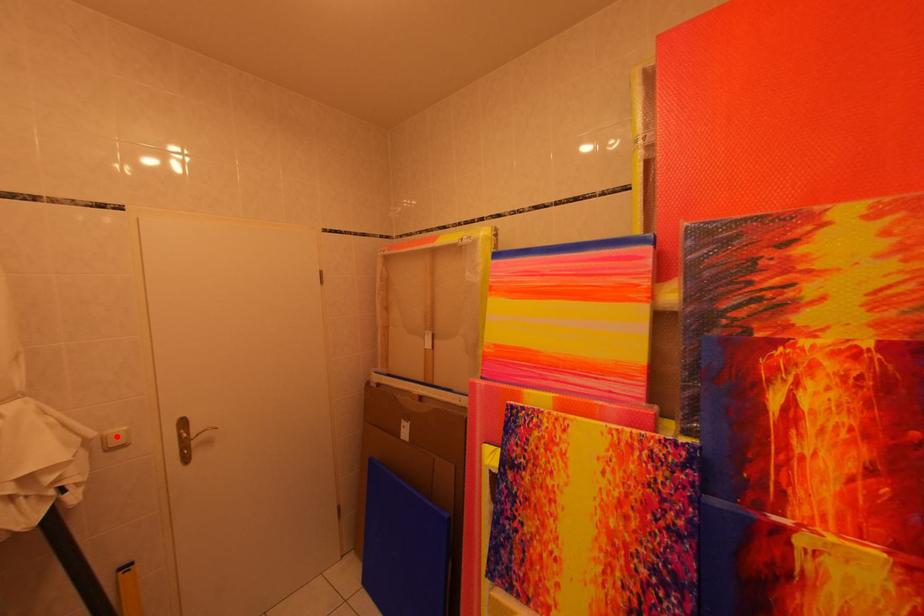
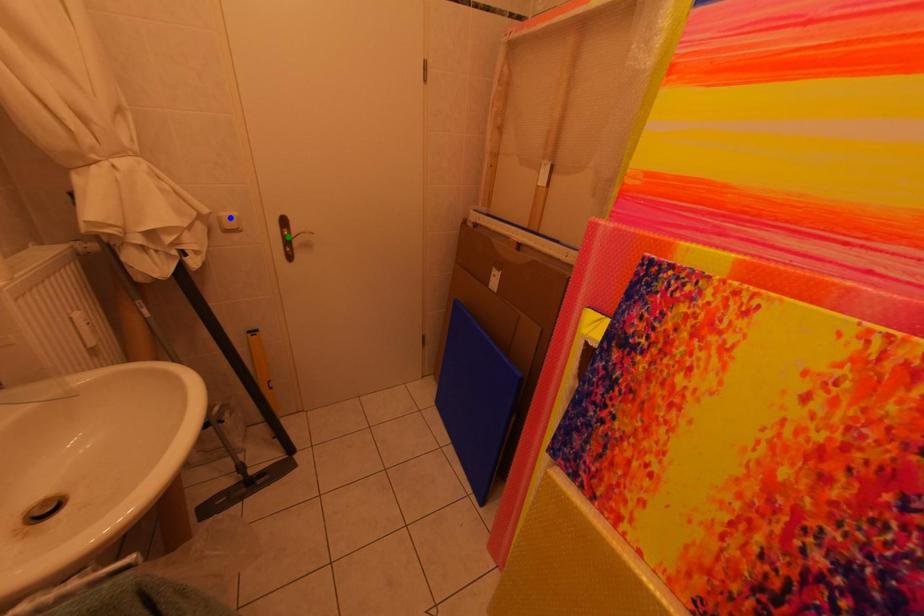
Question: I am providing you with two images of the same scene from different viewpoints. A red point is marked on the first image. You are given multiple points on the second image. Can you choose the point in image 2 that corresponds to the point in image 1?

Choices:
 (A) blue point
 (B) yellow point
 (C) green point

Answer: (A)